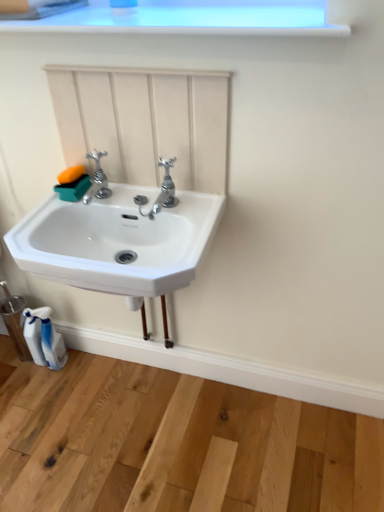
Find the location of a particular element. This screenshot has width=384, height=512. free area below white ceramic sink at center (from a real-world perspective) is located at coordinates (143, 408).